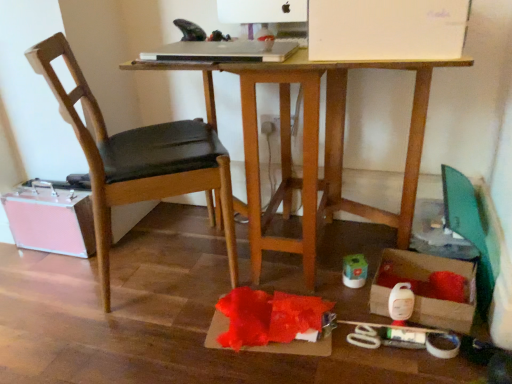
Question: Is black leather chair at left located outside pink metallic suitcase at lower left, the first storage box from the back?

Choices:
 (A) yes
 (B) no

Answer: (A)

Question: Considering the relative positions of black leather chair at left and pink metallic suitcase at lower left, positioned as the 2th storage box in front-to-back order, in the image provided, is black leather chair at left to the right of pink metallic suitcase at lower left, positioned as the 2th storage box in front-to-back order, from the viewer's perspective?

Choices:
 (A) no
 (B) yes

Answer: (B)

Question: From a real-world perspective, is black leather chair at left physically below pink metallic suitcase at lower left, placed as the 2th storage box when sorted from right to left?

Choices:
 (A) yes
 (B) no

Answer: (B)

Question: Would you consider black leather chair at left to be distant from pink metallic suitcase at lower left, the first storage box from the back?

Choices:
 (A) yes
 (B) no

Answer: (B)

Question: From the image's perspective, is black leather chair at left under pink metallic suitcase at lower left, positioned as the 2th storage box in front-to-back order?

Choices:
 (A) no
 (B) yes

Answer: (A)

Question: Does black leather chair at left have a greater height compared to pink metallic suitcase at lower left, placed as the 2th storage box when sorted from right to left?

Choices:
 (A) yes
 (B) no

Answer: (A)

Question: From the image's perspective, is wooden desk at center on top of black leather chair at left?

Choices:
 (A) yes
 (B) no

Answer: (A)

Question: Is wooden desk at center with black leather chair at left?

Choices:
 (A) no
 (B) yes

Answer: (A)

Question: Can you confirm if wooden desk at center is positioned to the right of black leather chair at left?

Choices:
 (A) no
 (B) yes

Answer: (B)

Question: Does wooden desk at center have a larger size compared to black leather chair at left?

Choices:
 (A) yes
 (B) no

Answer: (A)

Question: Is wooden desk at center positioned with its back to black leather chair at left?

Choices:
 (A) yes
 (B) no

Answer: (B)

Question: From the image's perspective, does wooden desk at center appear lower than black leather chair at left?

Choices:
 (A) no
 (B) yes

Answer: (A)

Question: Is black leather chair at left thinner than matte white power plugs and sockets at center?

Choices:
 (A) no
 (B) yes

Answer: (A)